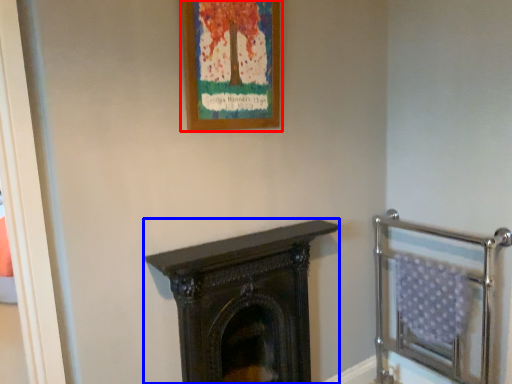
Question: Which object appears farthest to the camera in this image, picture frame (highlighted by a red box) or fireplace (highlighted by a blue box)?

Choices:
 (A) picture frame
 (B) fireplace

Answer: (B)